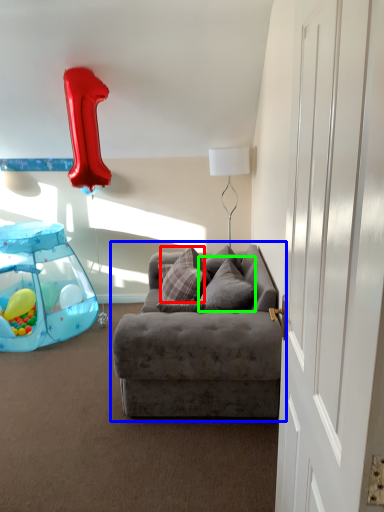
Question: Which object is positioned farthest from pillow (highlighted by a red box)? Select from studio couch (highlighted by a blue box) and pillow (highlighted by a green box).

Choices:
 (A) studio couch
 (B) pillow

Answer: (A)